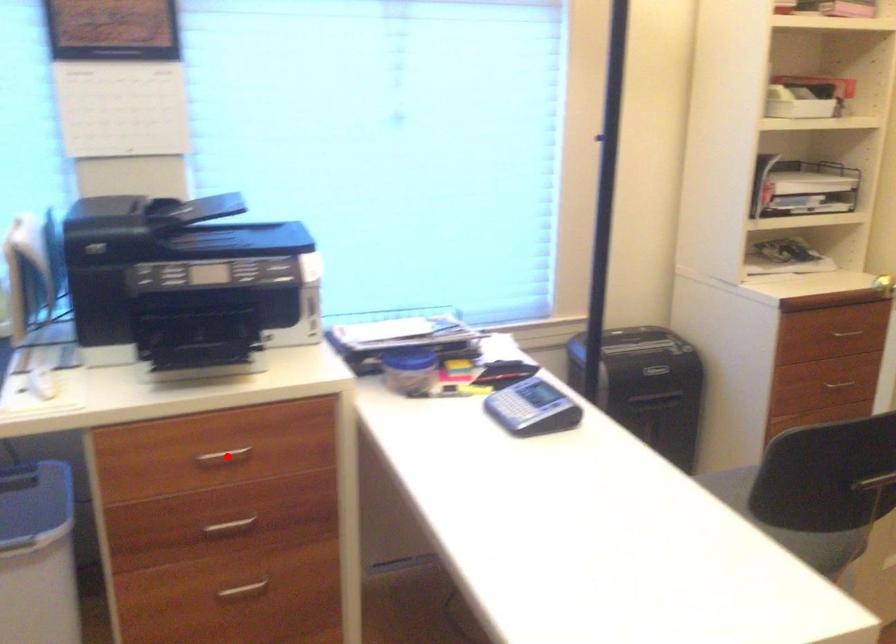
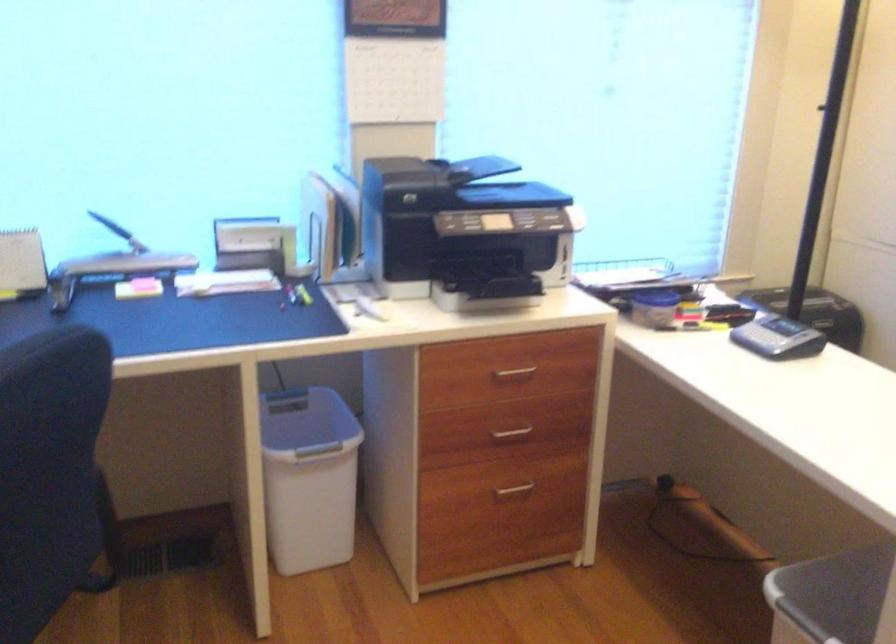
Question: I am providing you with two images of the same scene from different viewpoints. A red point is marked on the first image. Can you still see the location of the red point in image 2?

Choices:
 (A) Yes
 (B) No

Answer: (A)